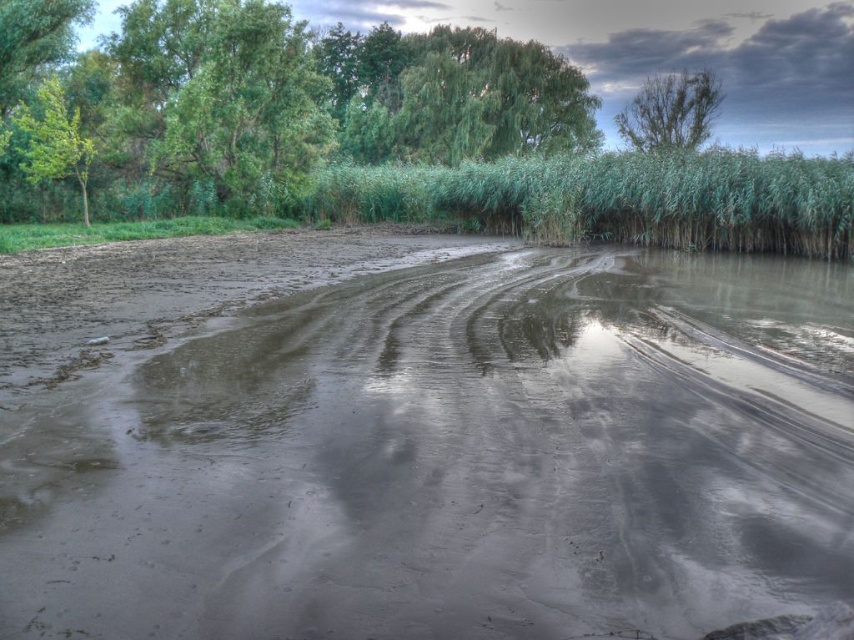
Question: Which is nearer to the green grassy reed at upper center?

Choices:
 (A) green leafy tree at upper center
 (B) green leafy tree at upper right
 (C) green leafy tree at upper left
 (D) muddy wetland at center

Answer: (B)

Question: Does muddy wetland at center have a smaller size compared to green grassy reed at upper center?

Choices:
 (A) no
 (B) yes

Answer: (B)

Question: Is green leafy tree at upper right smaller than green leafy tree at upper left?

Choices:
 (A) yes
 (B) no

Answer: (B)

Question: Which of the following is the farthest from the observer?

Choices:
 (A) muddy wetland at center
 (B) green leafy tree at upper center
 (C) green grassy reed at upper center
 (D) green leafy tree at upper left

Answer: (B)

Question: Which point appears closest to the camera in this image?

Choices:
 (A) (118, 339)
 (B) (51, 83)
 (C) (583, 134)

Answer: (A)

Question: Does green grassy reed at upper center have a greater width compared to green leafy tree at upper center?

Choices:
 (A) yes
 (B) no

Answer: (B)